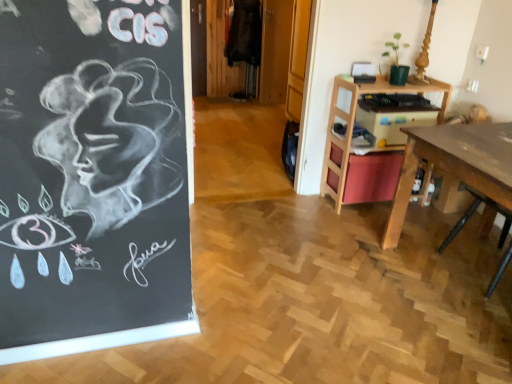
Describe the element at coordinates (458, 170) in the screenshot. I see `wooden desk at right` at that location.

The height and width of the screenshot is (384, 512). Identify the location of wooden desk at right. (458, 170).

The width and height of the screenshot is (512, 384). I want to click on wooden desk at right, so click(373, 136).

What do you see at coordinates (373, 136) in the screenshot? I see `wooden desk at right` at bounding box center [373, 136].

You are a GUI agent. You are given a task and a screenshot of the screen. Output one action in this format:
    pyautogui.click(x=<x>, y=<y>)
    Task: Click on the wooden desk at right
    
    Given the screenshot: What is the action you would take?
    pyautogui.click(x=458, y=170)

Visually, is wooden desk at right positioned to the left or to the right of wooden desk at right?

wooden desk at right is positioned on wooden desk at right's left side.

Considering the relative positions of wooden desk at right and wooden desk at right in the image provided, is wooden desk at right in front of wooden desk at right?

No, wooden desk at right is further to the viewer.

Does point (321, 179) lie in front of point (485, 187)?

No, it is behind (485, 187).

From the image's perspective, which object appears higher, wooden desk at right or wooden desk at right?

wooden desk at right.

From a real-world perspective, who is located lower, wooden desk at right or wooden desk at right?

wooden desk at right.

Which of these two, wooden desk at right or wooden desk at right, is wider?

With larger width is wooden desk at right.

Who is taller, wooden desk at right or wooden desk at right?

With more height is wooden desk at right.

Is wooden desk at right smaller than wooden desk at right?

Yes, wooden desk at right is smaller than wooden desk at right.

Is wooden desk at right not within wooden desk at right?

Yes, wooden desk at right is not within wooden desk at right.

Is wooden desk at right beside wooden desk at right?

No, wooden desk at right is not making contact with wooden desk at right.

Is wooden desk at right positioned with its back to wooden desk at right?

No.

What's the angular difference between wooden desk at right and wooden desk at right's facing directions?

88.3 degrees.

Where is `desk below the wooden desk at right (from a real-world perspective)`? The width and height of the screenshot is (512, 384). desk below the wooden desk at right (from a real-world perspective) is located at coordinates (458, 170).

Consider the image. Is wooden desk at right to the right of wooden desk at right from the viewer's perspective?

Yes, wooden desk at right is to the right of wooden desk at right.

Does wooden desk at right come in front of wooden desk at right?

That is True.

Which is nearer, (405, 173) or (339, 99)?

Point (405, 173) appears to be closer to the viewer than point (339, 99).

From the image's perspective, who appears lower, wooden desk at right or wooden desk at right?

wooden desk at right appears lower in the image.

From a real-world perspective, is wooden desk at right physically above wooden desk at right?

No, from a real-world perspective, wooden desk at right is not over wooden desk at right

Between wooden desk at right and wooden desk at right, which one has larger width?

Wider between the two is wooden desk at right.

Is wooden desk at right shorter than wooden desk at right?

Yes, wooden desk at right is shorter than wooden desk at right.

Based on their sizes in the image, would you say wooden desk at right is bigger or smaller than wooden desk at right?

wooden desk at right is bigger than wooden desk at right.

Is wooden desk at right completely or partially inside wooden desk at right?

No, wooden desk at right does not contain wooden desk at right.

Is wooden desk at right beside wooden desk at right?

wooden desk at right and wooden desk at right are clearly separated.

Is wooden desk at right oriented away from wooden desk at right?

No, wooden desk at right is not facing away from wooden desk at right.

At what (x,y) coordinates should I click in order to perform the action: click on table that is on the left side of wooden desk at right. Please return your answer as a coordinate pair (x, y). Looking at the image, I should click on (373, 136).

Locate an element on the screen. table above the wooden desk at right (from the image's perspective) is located at coordinates (373, 136).

Where is `desk below the wooden desk at right (from the image's perspective)`? desk below the wooden desk at right (from the image's perspective) is located at coordinates (458, 170).